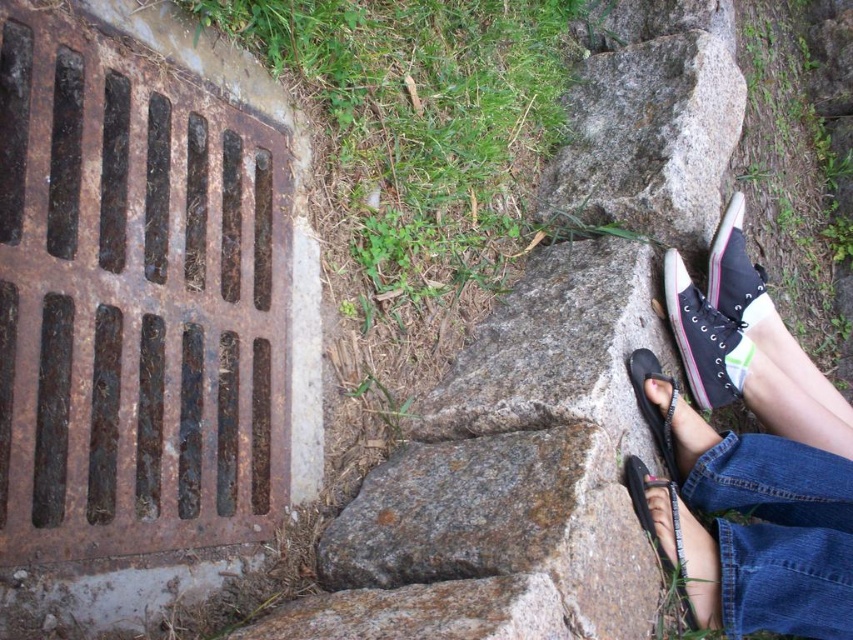
You are standing in front of the stone steps and want to place a small object at the point closer to you between point (698, 368) and point (680, 422). Which point should you choose?

Point (698, 368) is further to the camera than point (680, 422), so the point closer to you is point (680, 422). You should place the small object at point (680, 422).

You are standing on the stone steps and want to step onto the green grass at upper center. Is the black canvas shoe at right in your way?

The green grass at upper center is closer to the viewer than the black canvas shoe at right, meaning the black canvas shoe at right is behind the grass. Therefore, it is not blocking your path to the green grass at upper center.